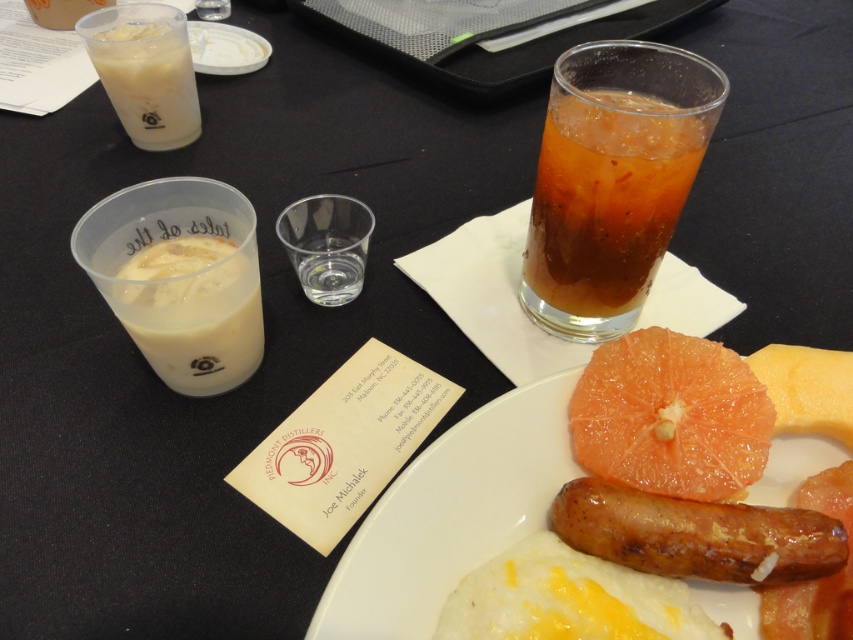
You are a barista preparing a latte for a customer. You have a white opaque cup at upper left and a milky white liquid at left. Which one is smaller in size?

The milky white liquid at left has a smaller size compared to the white opaque cup at upper left.

You are sitting at the breakfast table and want to reach for the item located at point (164,45). However, there is an obstacle at point (706,545) blocking your path. Can you safely reach the item without moving the obstacle?

Point (706,545) is in front of point (164,45), so the obstacle at point (706,545) is blocking the path to the item at point (164,45). Therefore, you cannot safely reach the item without moving the obstacle.